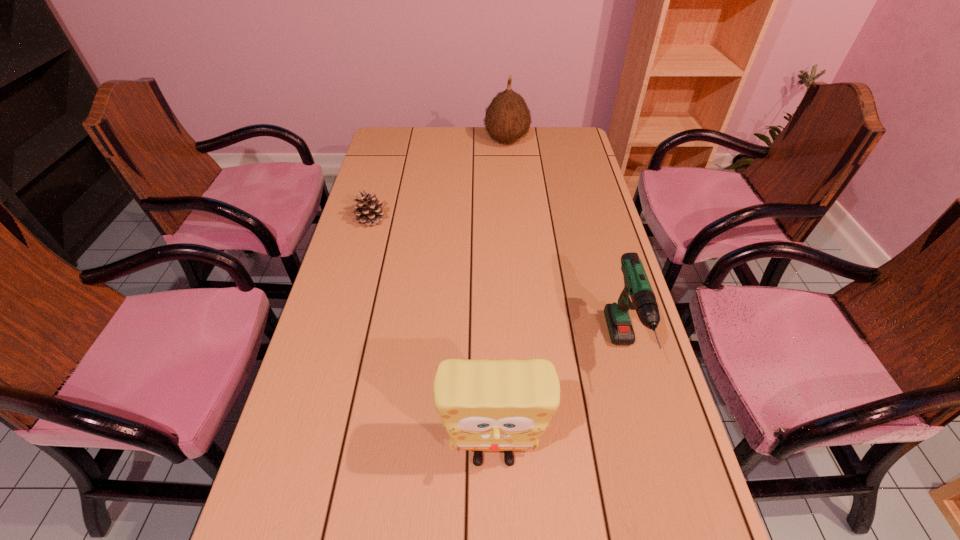
Identify the location of the farthest object. (507, 118).

Locate an element on the screen. The image size is (960, 540). sponge is located at coordinates (505, 405).

The image size is (960, 540). In order to click on drill in this screenshot , I will do `click(637, 294)`.

Identify the location of the second nearest object. (637, 294).

Find the location of a particular element. the third nearest object is located at coordinates (368, 211).

What are the coordinates of `pinecone` in the screenshot? It's located at (368, 211).

This screenshot has width=960, height=540. I want to click on blank area located 0.350m on the surface of the coconut, so click(396, 140).

The image size is (960, 540). Find the location of `free space located 0.150m on the surface of the coconut`. free space located 0.150m on the surface of the coconut is located at coordinates (446, 140).

Locate an element on the screen. Image resolution: width=960 pixels, height=540 pixels. vacant space located on the surface of the coconut is located at coordinates (412, 140).

Locate an element on the screen. This screenshot has height=540, width=960. free space located on the handle side of the third farthest object is located at coordinates (655, 467).